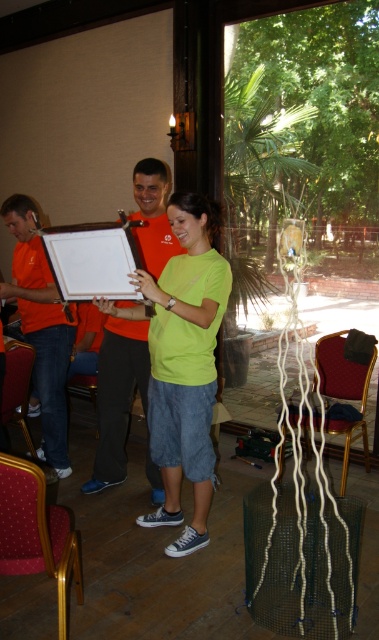
Is point (211, 307) positioned in front of point (20, 365)?

Yes, it is in front of point (20, 365).

Does point (197, 547) come farther from viewer compared to point (15, 417)?

No, it is not.

I want to click on green matte shirt at center, so click(186, 365).

Does point (59, 592) lie behind point (70, 248)?

No, (59, 592) is in front of (70, 248).

Is gold metallic chair at lower left to the left of white cardboard at center from the viewer's perspective?

Indeed, gold metallic chair at lower left is positioned on the left side of white cardboard at center.

Where is `gold metallic chair at lower left`? gold metallic chair at lower left is located at coordinates pyautogui.click(x=36, y=532).

Which is above, gold metallic chair at lower left or velvet red chair at lower right?

velvet red chair at lower right is above.

Which of these two, gold metallic chair at lower left or velvet red chair at lower right, stands taller?

velvet red chair at lower right

Who is more distant from viewer, (79, 600) or (369, 369)?

Positioned behind is point (369, 369).

The width and height of the screenshot is (379, 640). I want to click on gold metallic chair at lower left, so (x=36, y=532).